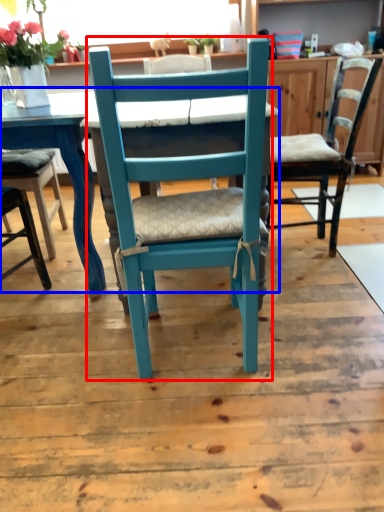
Question: Which of the following is the closest to the observer, chair (highlighted by a red box) or table (highlighted by a blue box)?

Choices:
 (A) chair
 (B) table

Answer: (A)